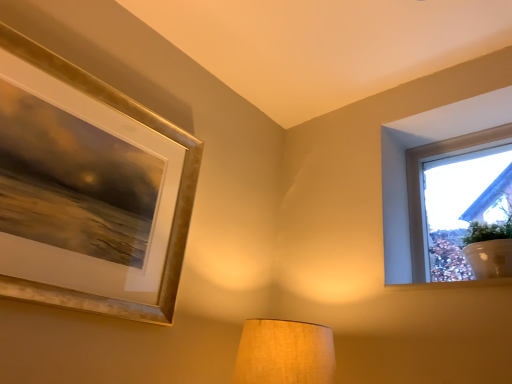
Question: Could you tell me if gold metallic picture frame at upper left is turned towards white painted wood at upper right?

Choices:
 (A) yes
 (B) no

Answer: (B)

Question: From a real-world perspective, does gold metallic picture frame at upper left sit lower than white painted wood at upper right?

Choices:
 (A) no
 (B) yes

Answer: (A)

Question: Could white painted wood at upper right be considered to be inside gold metallic picture frame at upper left?

Choices:
 (A) yes
 (B) no

Answer: (B)

Question: Is gold metallic picture frame at upper left not within white painted wood at upper right?

Choices:
 (A) yes
 (B) no

Answer: (A)

Question: From the image's perspective, would you say gold metallic picture frame at upper left is positioned over white painted wood at upper right?

Choices:
 (A) yes
 (B) no

Answer: (A)

Question: Is gold metallic picture frame at upper left further to camera compared to white painted wood at upper right?

Choices:
 (A) yes
 (B) no

Answer: (B)

Question: Does gold metallic picture frame at upper left come behind transparent glass window at upper right?

Choices:
 (A) yes
 (B) no

Answer: (B)

Question: Are gold metallic picture frame at upper left and transparent glass window at upper right far apart?

Choices:
 (A) no
 (B) yes

Answer: (B)

Question: Is gold metallic picture frame at upper left with transparent glass window at upper right?

Choices:
 (A) no
 (B) yes

Answer: (A)

Question: From a real-world perspective, is gold metallic picture frame at upper left physically below transparent glass window at upper right?

Choices:
 (A) yes
 (B) no

Answer: (A)

Question: From a real-world perspective, is gold metallic picture frame at upper left on transparent glass window at upper right?

Choices:
 (A) no
 (B) yes

Answer: (A)

Question: Is gold metallic picture frame at upper left outside of transparent glass window at upper right?

Choices:
 (A) no
 (B) yes

Answer: (B)

Question: Is white painted wood at upper right not within transparent glass window at upper right?

Choices:
 (A) yes
 (B) no

Answer: (A)